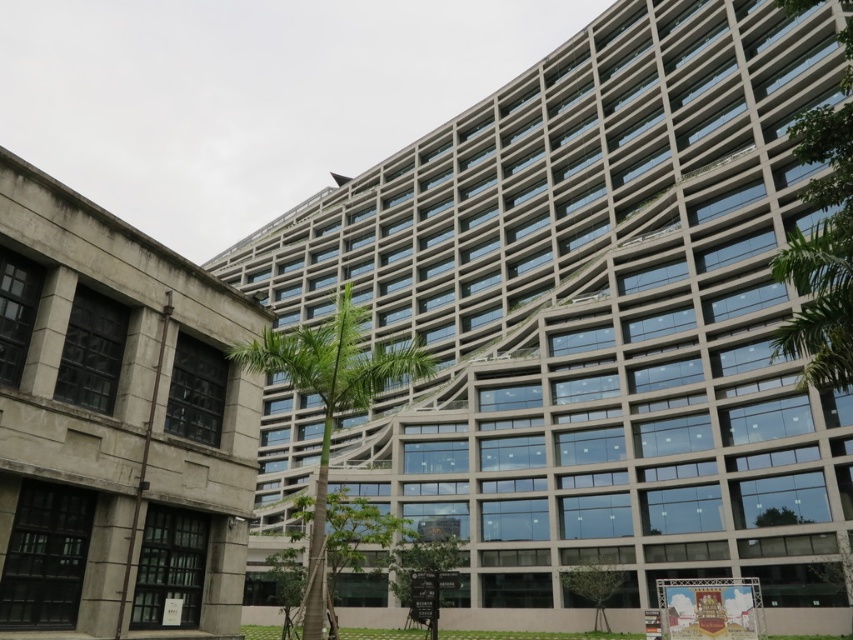
Is point (363, 384) behind point (625, 572)?

No, (363, 384) is in front of (625, 572).

Which is behind, point (352, 333) or point (602, 589)?

The point (602, 589) is behind.

What do you see at coordinates (329, 401) in the screenshot? I see `green leafy palm tree at center` at bounding box center [329, 401].

The image size is (853, 640). Find the location of `green leafy palm tree at center`. green leafy palm tree at center is located at coordinates (329, 401).

Does green leafy tree at right have a smaller size compared to green leafy tree at lower center?

Incorrect, green leafy tree at right is not smaller in size than green leafy tree at lower center.

Is green leafy tree at right to the left of green leafy tree at lower center from the viewer's perspective?

In fact, green leafy tree at right is to the right of green leafy tree at lower center.

Is point (775, 344) closer to viewer compared to point (585, 566)?

Yes, it is in front of point (585, 566).

The height and width of the screenshot is (640, 853). Identify the location of green leafy tree at right. (821, 253).

Does green leafy tree at right appear over green leafy palm tree at center?

Yes, green leafy tree at right is above green leafy palm tree at center.

Describe the element at coordinates (821, 253) in the screenshot. I see `green leafy tree at right` at that location.

Find the location of a particular element. The image size is (853, 640). green leafy tree at right is located at coordinates (821, 253).